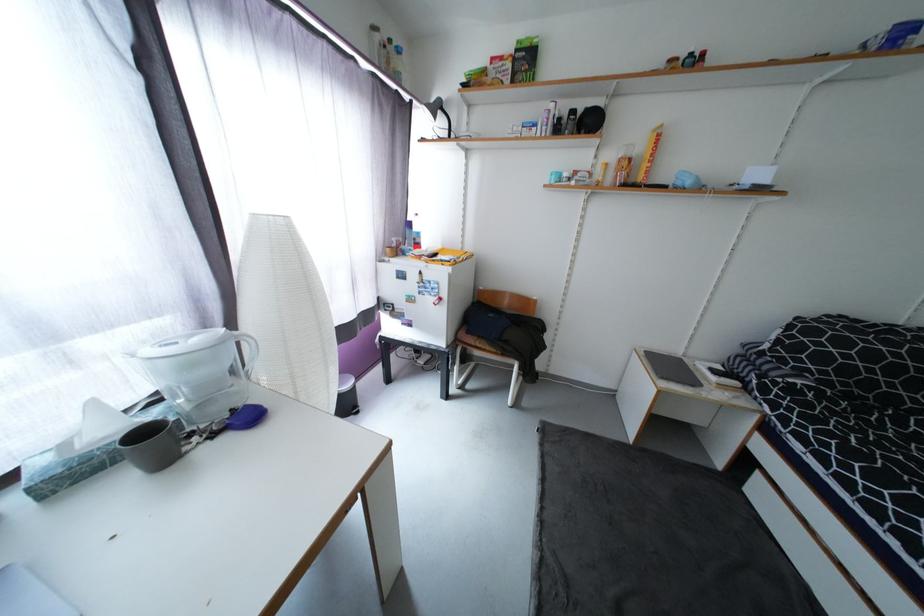
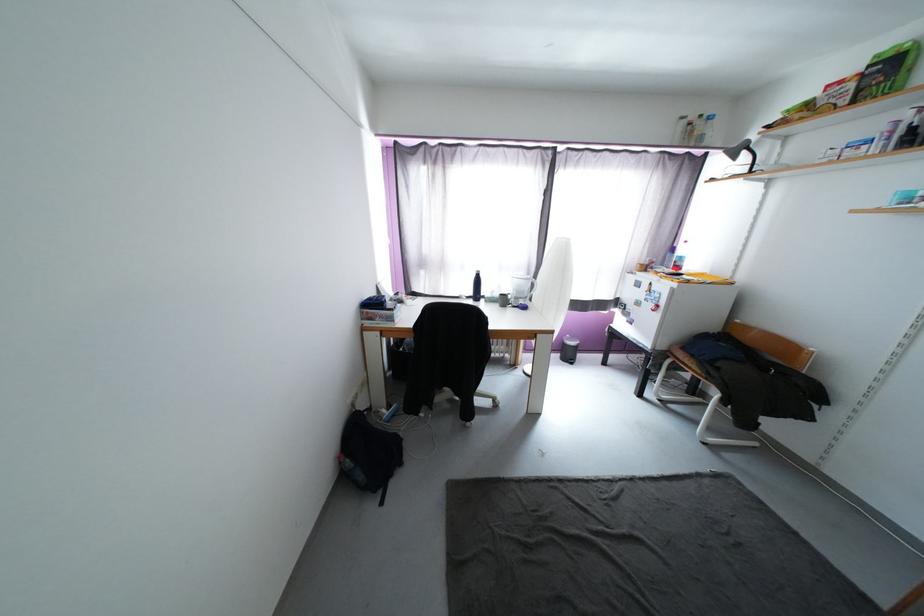
In the second image, find the point that corresponds to point (150, 436) in the first image.

(508, 296)